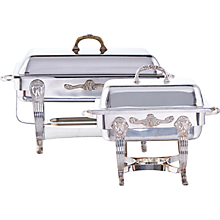
This screenshot has height=220, width=220. What are the coordinates of `side handle small chafing dish` in the screenshot? It's located at (215, 109).